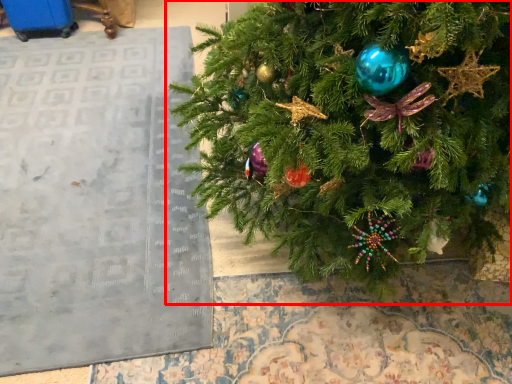
Question: Observing the image, what is the correct spatial positioning of christmas tree (annotated by the red box) in reference to bulletin board?

Choices:
 (A) right
 (B) left

Answer: (A)